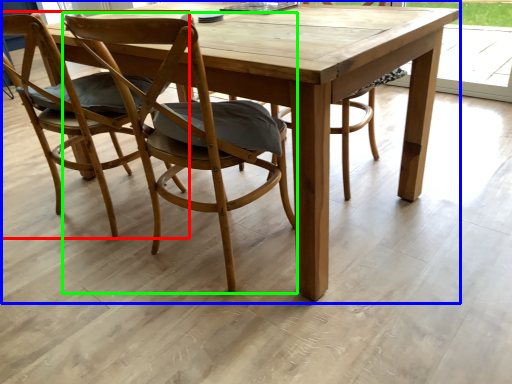
Question: Which object is the farthest from chair (highlighted by a red box)? Choose among these: picnic table (highlighted by a blue box) or chair (highlighted by a green box).

Choices:
 (A) picnic table
 (B) chair

Answer: (A)